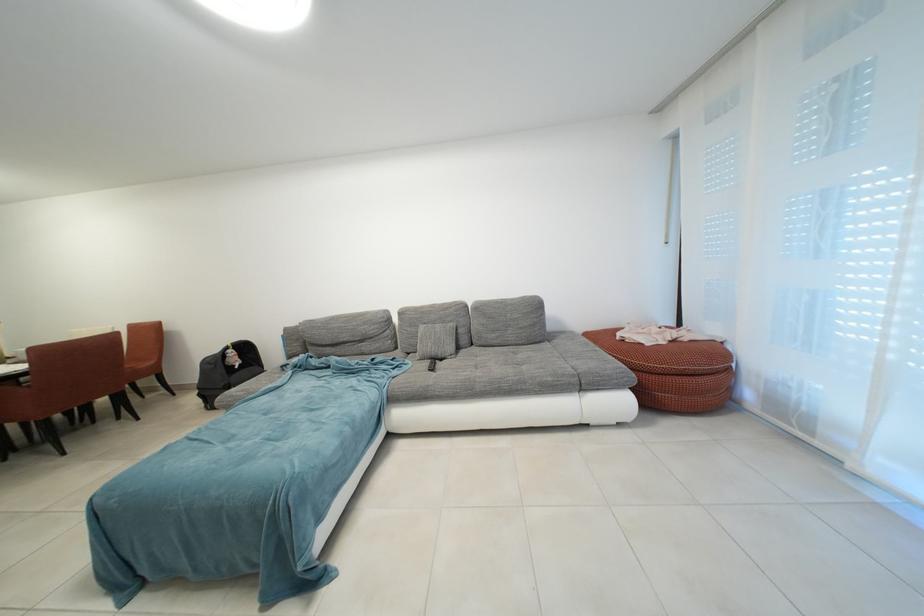
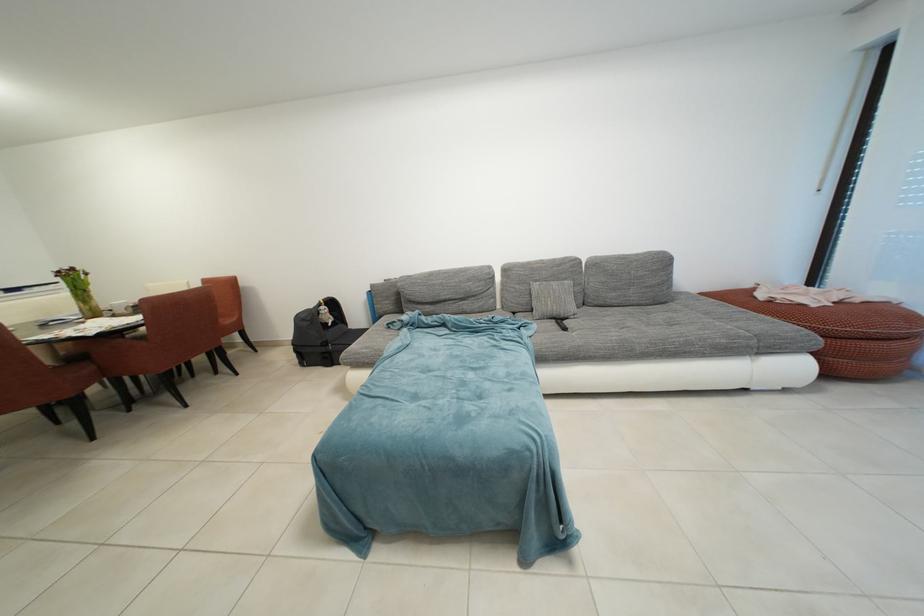
The point at (x=434, y=368) is marked in the first image. Where is the corresponding point in the second image?

(560, 328)